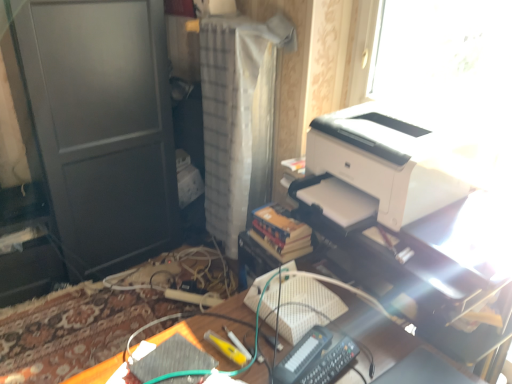
I want to click on vacant space behind black plastic remote control at center, so click(x=306, y=326).